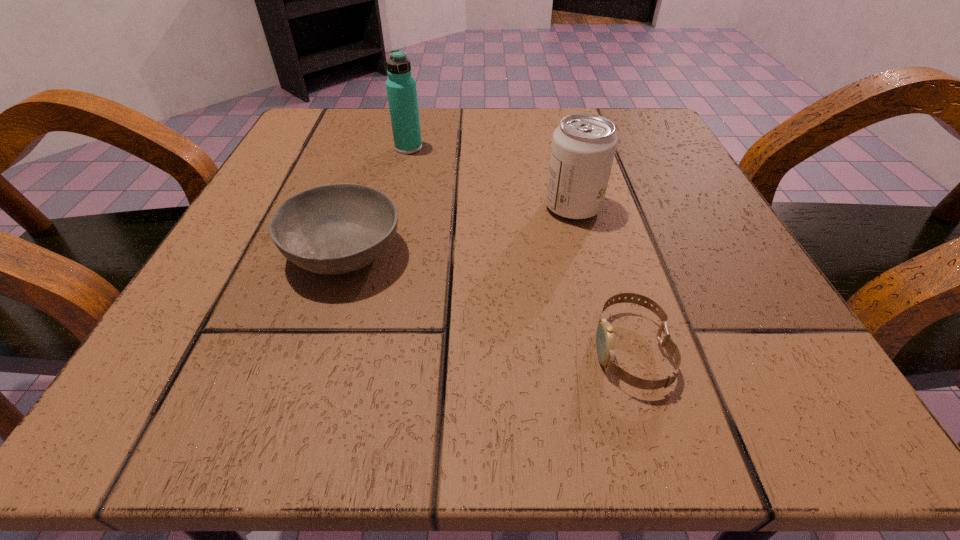
Image resolution: width=960 pixels, height=540 pixels. Identify the location of the tallest object. (401, 89).

Locate an element on the screen. the farthest object is located at coordinates (401, 89).

Image resolution: width=960 pixels, height=540 pixels. I want to click on the second tallest object, so click(x=583, y=147).

Identify the location of the second shortest object. (331, 229).

Locate an element on the screen. This screenshot has height=540, width=960. watch is located at coordinates (605, 342).

Locate an element on the screen. The width and height of the screenshot is (960, 540). the nearest object is located at coordinates click(x=605, y=342).

Where is `vacant area located on the right of the farthest object`? vacant area located on the right of the farthest object is located at coordinates (571, 148).

Identify the location of vacant space positioned on the back of the soda can. (564, 168).

Where is `vacant space situated on the right of the second shortest object`? vacant space situated on the right of the second shortest object is located at coordinates (666, 253).

Image resolution: width=960 pixels, height=540 pixels. I want to click on free point located 0.220m on the face of the nearest object, so click(402, 350).